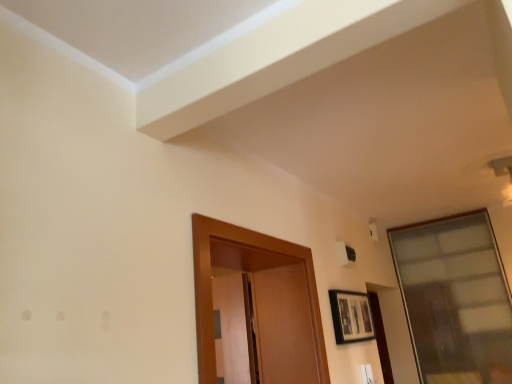
Measure the distance between point (355, 337) and camera.

Point (355, 337) and camera are 7.21 feet apart from each other.

Where is `matte black picture frame at lower right`? The image size is (512, 384). matte black picture frame at lower right is located at coordinates point(351,316).

What do you see at coordinates (351, 316) in the screenshot?
I see `matte black picture frame at lower right` at bounding box center [351, 316].

At what (x,y) coordinates should I click in order to perform the action: click on transparent glass window at upper right. Please return your answer as a coordinate pair (x, y). This screenshot has width=512, height=384. Looking at the image, I should click on (455, 299).

The image size is (512, 384). What do you see at coordinates (455, 299) in the screenshot?
I see `transparent glass window at upper right` at bounding box center [455, 299].

This screenshot has width=512, height=384. I want to click on matte black picture frame at lower right, so click(351, 316).

In the image, is transparent glass window at upper right on the left side or the right side of matte black picture frame at lower right?

In the image, transparent glass window at upper right appears on the right side of matte black picture frame at lower right.

Which object is closer to the camera taking this photo, transparent glass window at upper right or matte black picture frame at lower right?

matte black picture frame at lower right is in front.

Which is less distant, (448,228) or (341,291)?

The point (341,291) is closer.

From the image's perspective, is transparent glass window at upper right located above matte black picture frame at lower right?

No.

From a real-world perspective, which is physically above, transparent glass window at upper right or matte black picture frame at lower right?

From a 3D spatial view, transparent glass window at upper right is above.

In the scene shown: Which object is wider, transparent glass window at upper right or matte black picture frame at lower right?

Wider between the two is transparent glass window at upper right.

Considering the sizes of objects transparent glass window at upper right and matte black picture frame at lower right in the image provided, who is taller, transparent glass window at upper right or matte black picture frame at lower right?

transparent glass window at upper right is taller.

Is transparent glass window at upper right smaller than matte black picture frame at lower right?

No.

Is transparent glass window at upper right outside of matte black picture frame at lower right?

Yes.

Are transparent glass window at upper right and matte black picture frame at lower right located far from each other?

Indeed, transparent glass window at upper right is not near matte black picture frame at lower right.

Is matte black picture frame at lower right at the back of transparent glass window at upper right?

transparent glass window at upper right does not have its back to matte black picture frame at lower right.

How much distance is there between transparent glass window at upper right and matte black picture frame at lower right?

transparent glass window at upper right and matte black picture frame at lower right are 1.10 meters apart.

What are the coordinates of `window below the matte black picture frame at lower right (from the image's perspective)` in the screenshot? It's located at (455, 299).

In the scene shown: Considering the relative positions of matte black picture frame at lower right and transparent glass window at upper right in the image provided, is matte black picture frame at lower right to the left of transparent glass window at upper right from the viewer's perspective?

Indeed, matte black picture frame at lower right is positioned on the left side of transparent glass window at upper right.

Considering the relative positions of matte black picture frame at lower right and transparent glass window at upper right in the image provided, is matte black picture frame at lower right in front of transparent glass window at upper right?

Yes, matte black picture frame at lower right is closer to the camera.

Is point (358, 296) closer to camera compared to point (446, 380)?

Yes, it is.

From the image's perspective, does matte black picture frame at lower right appear lower than transparent glass window at upper right?

No, from the image's perspective, matte black picture frame at lower right is not below transparent glass window at upper right.

From a real-world perspective, is matte black picture frame at lower right located higher than transparent glass window at upper right?

No, from a real-world perspective, matte black picture frame at lower right is not over transparent glass window at upper right

Considering the sizes of matte black picture frame at lower right and transparent glass window at upper right in the image, is matte black picture frame at lower right wider or thinner than transparent glass window at upper right?

Clearly, matte black picture frame at lower right has less width compared to transparent glass window at upper right.

Can you confirm if matte black picture frame at lower right is shorter than transparent glass window at upper right?

Correct, matte black picture frame at lower right is not as tall as transparent glass window at upper right.

Looking at the image, does matte black picture frame at lower right seem bigger or smaller compared to transparent glass window at upper right?

Considering their sizes, matte black picture frame at lower right takes up less space than transparent glass window at upper right.

Can transparent glass window at upper right be found inside matte black picture frame at lower right?

No, transparent glass window at upper right is not inside matte black picture frame at lower right.

Is matte black picture frame at lower right next to transparent glass window at upper right and touching it?

There is a gap between matte black picture frame at lower right and transparent glass window at upper right.

Is matte black picture frame at lower right positioned with its back to transparent glass window at upper right?

No, transparent glass window at upper right is not at the back of matte black picture frame at lower right.

How many degrees apart are the facing directions of matte black picture frame at lower right and transparent glass window at upper right?

The facing directions of matte black picture frame at lower right and transparent glass window at upper right are 90.1 degrees apart.

How much distance is there between matte black picture frame at lower right and transparent glass window at upper right?

matte black picture frame at lower right is 1.10 meters from transparent glass window at upper right.

Locate an element on the screen. This screenshot has width=512, height=384. window located above the matte black picture frame at lower right (from a real-world perspective) is located at coordinates (455, 299).

Locate an element on the screen. This screenshot has width=512, height=384. window that is behind the matte black picture frame at lower right is located at coordinates (455, 299).

The height and width of the screenshot is (384, 512). In order to click on picture frame on the left of transparent glass window at upper right in this screenshot , I will do pyautogui.click(x=351, y=316).